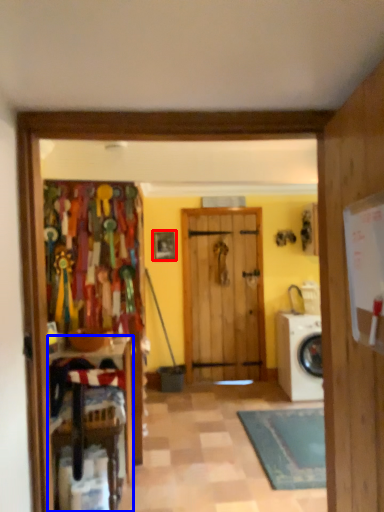
Question: Among these objects, which one is farthest to the camera, picture frame (highlighted by a red box) or furniture (highlighted by a blue box)?

Choices:
 (A) picture frame
 (B) furniture

Answer: (A)